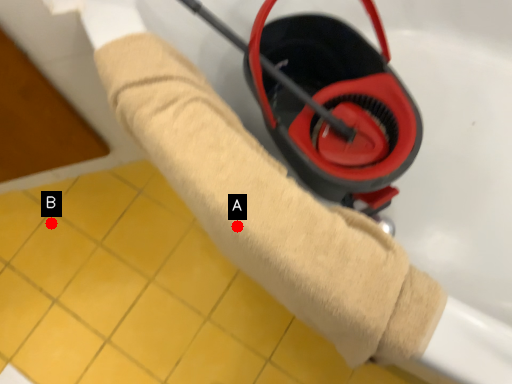
Question: Two points are circled on the image, labeled by A and B beside each circle. Among these points, which one is farthest from the camera?

Choices:
 (A) A is further
 (B) B is further

Answer: (B)